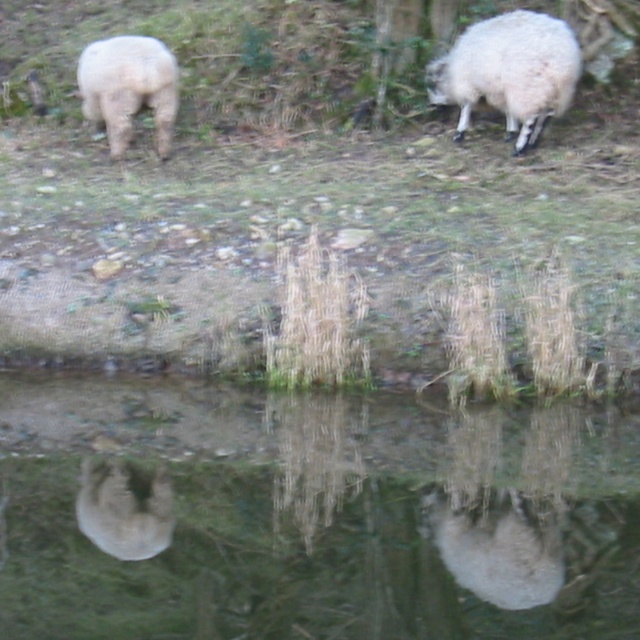
Can you confirm if transparent glass puddle at center is shorter than white woolly sheep at upper right?

Yes.

Is transparent glass puddle at center below white woolly sheep at upper right?

Yes.

Describe the element at coordinates (310, 513) in the screenshot. I see `transparent glass puddle at center` at that location.

The width and height of the screenshot is (640, 640). Find the location of `transparent glass puddle at center`. transparent glass puddle at center is located at coordinates (310, 513).

Is transparent glass puddle at center taller than white woolly sheep at upper left?

Incorrect, transparent glass puddle at center's height is not larger of white woolly sheep at upper left's.

Does transparent glass puddle at center appear under white woolly sheep at upper left?

Indeed, transparent glass puddle at center is positioned under white woolly sheep at upper left.

What do you see at coordinates (310, 513) in the screenshot? I see `transparent glass puddle at center` at bounding box center [310, 513].

You are a GUI agent. You are given a task and a screenshot of the screen. Output one action in this format:
    pyautogui.click(x=<x>, y=<y>)
    Task: Click on the transparent glass puddle at center
    This screenshot has height=640, width=640.
    Given the screenshot: What is the action you would take?
    pyautogui.click(x=310, y=513)

Is transparent glass puddle at center below white fluffy sheep at lower center?

No, transparent glass puddle at center is not below white fluffy sheep at lower center.

Which is in front, point (106, 577) or point (426, 531)?

Positioned in front is point (106, 577).

Between point (56, 548) and point (483, 538), which one is positioned in front?

Point (56, 548) is in front.

Find the location of a particular element. transparent glass puddle at center is located at coordinates (310, 513).